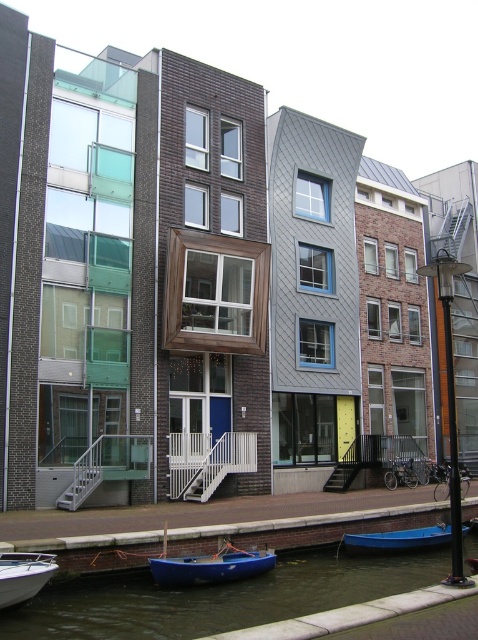
You are a delivery person trying to reach the middle building on the canal. Your boat, which is 10 feet long, is currently docked at the white fiberglass boat at lower left. Can you maneuver your boat to the dark blue water at lower center without needing to move it entirely? Explain your reasoning.

The dark blue water at lower center and white fiberglass boat at lower left are 9.76 feet apart. Since your boat is 10 feet long, it cannot fit between them without moving the boat entirely, as the distance is shorter than the boat length.

You are standing on the dock and want to board the white fiberglass boat at lower left. Which direction should you move to reach it from the dark blue water at lower center?

The dark blue water at lower center is further to the viewer than the white fiberglass boat at lower left, so you should move towards the lower left direction to reach it.

What is located at the point with coordinates (212, 566) in the image?

The blue matte boat at lower center is located at the point with coordinates (212, 566).